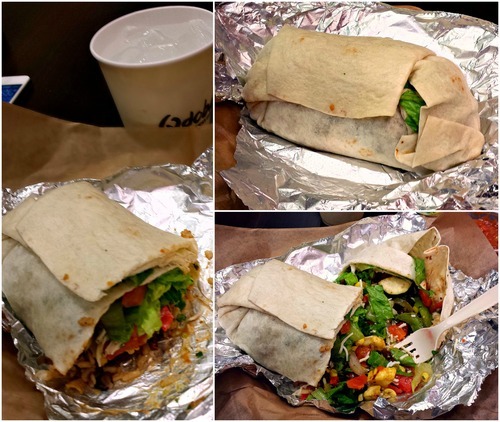
This screenshot has width=500, height=422. In order to click on phone in this screenshot , I will do `click(19, 80)`.